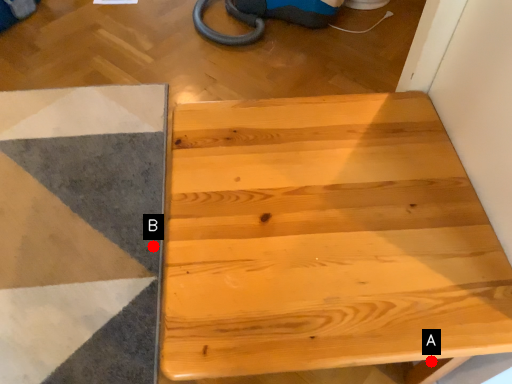
Question: Two points are circled on the image, labeled by A and B beside each circle. Which point is closer to the camera?

Choices:
 (A) A is closer
 (B) B is closer

Answer: (A)